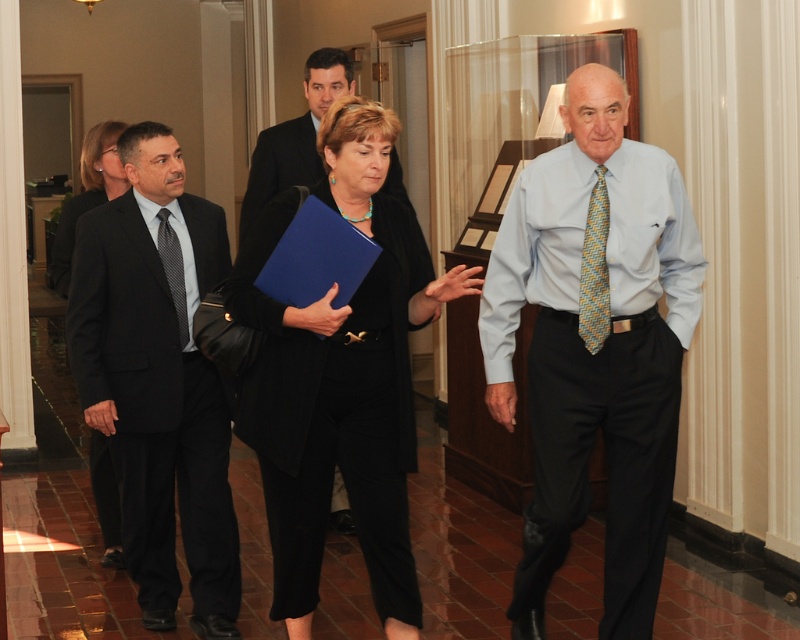
You are standing in the hallway and want to take a photo of the point at coordinates point (86, 209). If your camera has a maximum focus range of 5 meters, will it be able to focus on that point?

The distance of point (86, 209) from the camera is 5.03 meters, which is slightly beyond the camera maximum focus range of 5 meters. Therefore, the camera will not be able to focus on that point.